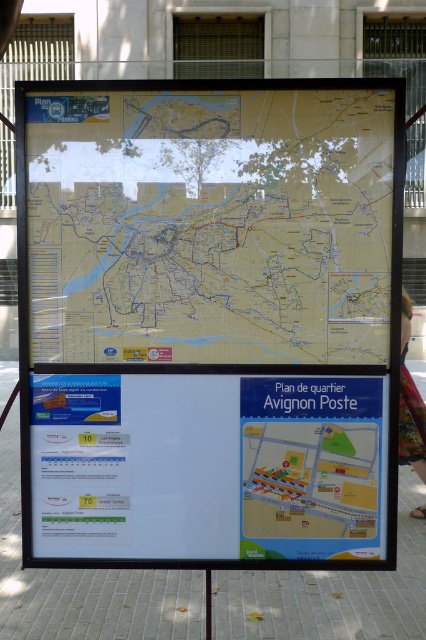
Does yellow paper map at center appear over white paper at center?

Indeed, yellow paper map at center is positioned over white paper at center.

The image size is (426, 640). I want to click on yellow paper map at center, so click(x=210, y=225).

Which of these two, white paper at center or blue paper map at center, stands taller?

With more height is white paper at center.

Between white paper at center and blue paper map at center, which one appears on the right side from the viewer's perspective?

From the viewer's perspective, blue paper map at center appears more on the right side.

Is point (72, 531) less distant than point (270, 456)?

No, (72, 531) is behind (270, 456).

You are a GUI agent. You are given a task and a screenshot of the screen. Output one action in this format:
    pyautogui.click(x=<x>, y=<y>)
    Task: Click on the white paper at center
    Image resolution: width=426 pixels, height=640 pixels.
    Given the screenshot: What is the action you would take?
    pyautogui.click(x=207, y=467)

In the scene shown: Is yellow paper map at center to the right of blue paper map at center from the viewer's perspective?

No, yellow paper map at center is not to the right of blue paper map at center.

Does yellow paper map at center have a lesser width compared to blue paper map at center?

Incorrect, yellow paper map at center's width is not less than blue paper map at center's.

Who is more forward, (192,284) or (285,545)?

Point (192,284)

Image resolution: width=426 pixels, height=640 pixels. Find the location of `yellow paper map at center`. yellow paper map at center is located at coordinates (210, 225).